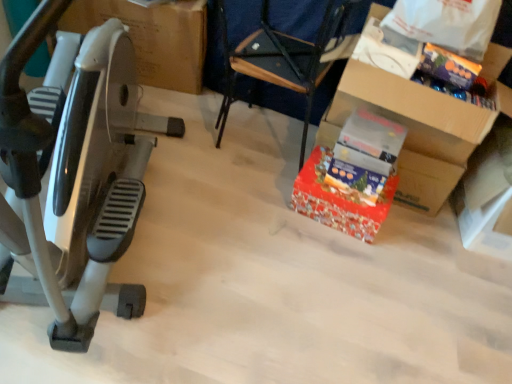
The height and width of the screenshot is (384, 512). I want to click on vacant area that lies to the right of silver metallic stationary bicycle at left, so click(274, 267).